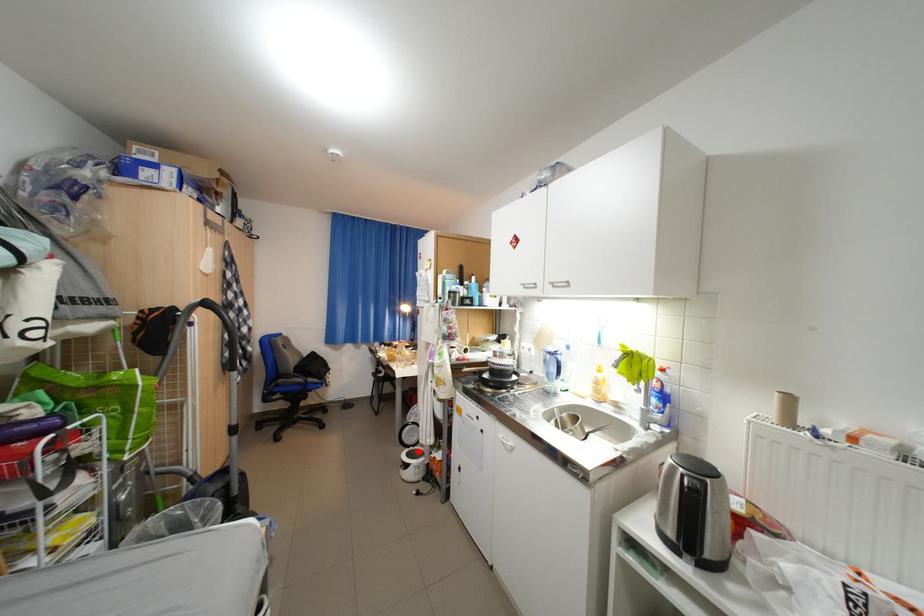
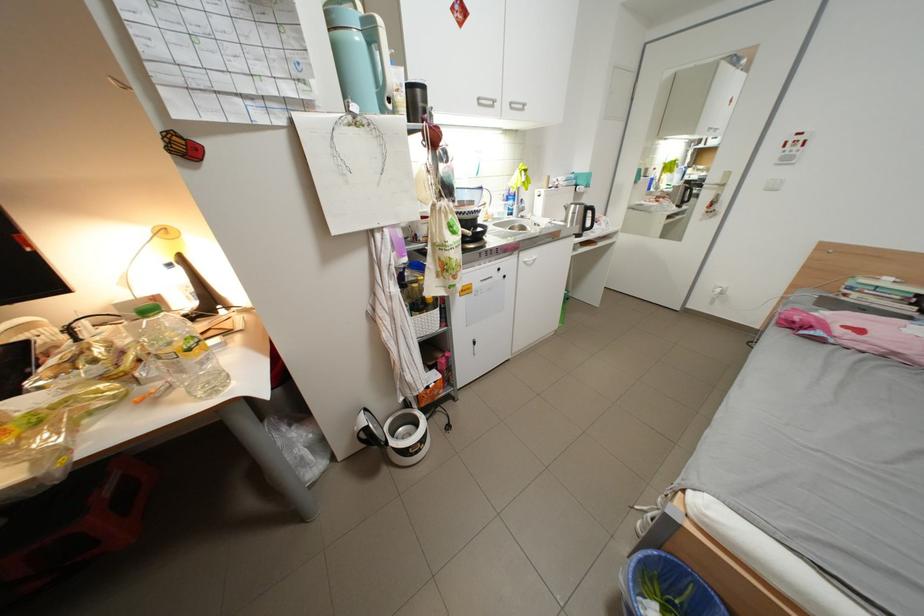
Question: A red point is marked in image1. In image2, is the corresponding 3D point closer to the camera or farther? Reply with the corresponding letter.

Choices:
 (A) The corresponding 3D point is closer.
 (B) The corresponding 3D point is farther.

Answer: (A)